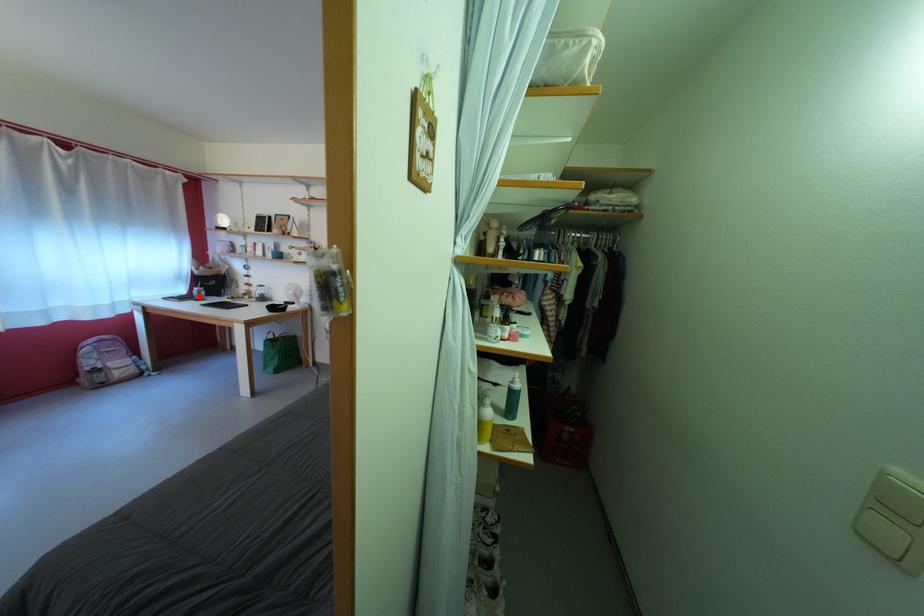
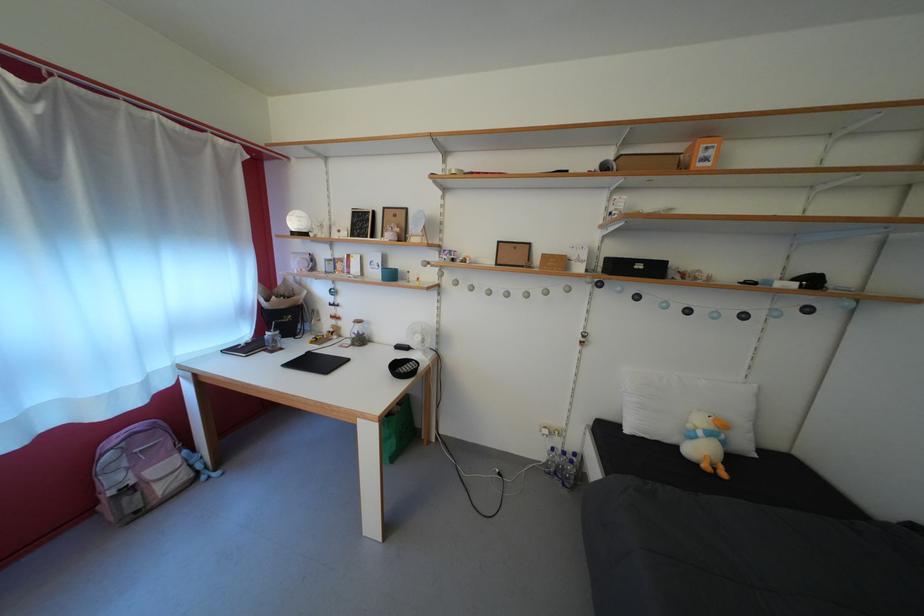
Question: I am providing you with two images of the same scene from different viewpoints. A red point is marked on the first image. Is the red point's position out of view in image 2?

Choices:
 (A) Yes
 (B) No

Answer: (B)